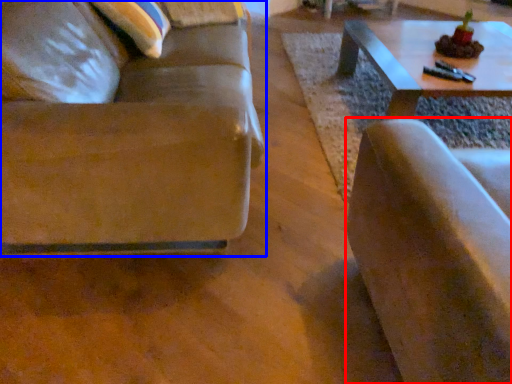
Question: Which object is further to the camera taking this photo, chair (highlighted by a red box) or studio couch (highlighted by a blue box)?

Choices:
 (A) chair
 (B) studio couch

Answer: (B)